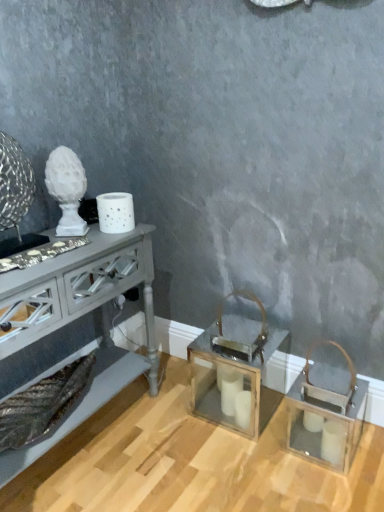
What are the coordinates of `free spot to the left of clear glass lantern at center, the 2th table in the left-to-right sequence` in the screenshot? It's located at (168, 415).